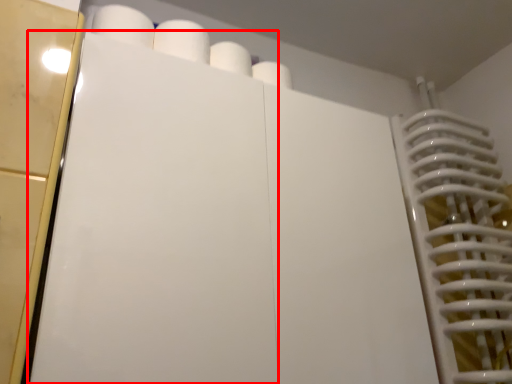
Question: Considering the relative positions of door (annotated by the red box) and paper towel in the image provided, where is door (annotated by the red box) located with respect to the staircase?

Choices:
 (A) right
 (B) left

Answer: (A)